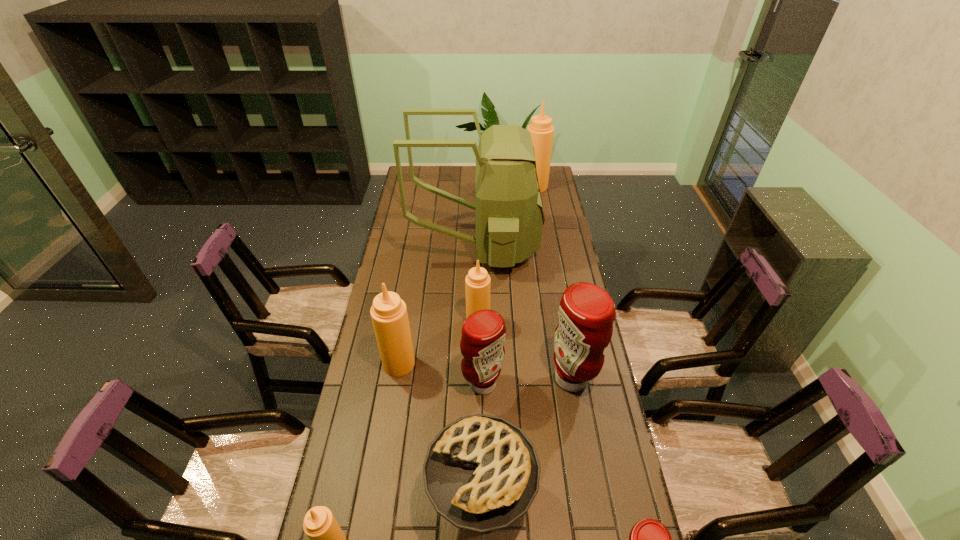
Image resolution: width=960 pixels, height=540 pixels. I want to click on vacant region located 0.130m on the front pocket of the backpack, so click(567, 246).

What are the coordinates of `vacant space located 0.100m on the front of the biggest tan condiment` in the screenshot? It's located at (539, 204).

The image size is (960, 540). Find the location of `blank space located on the back of the second biggest tan condiment`. blank space located on the back of the second biggest tan condiment is located at coordinates (404, 335).

Locate an element on the screen. This screenshot has width=960, height=540. vacant space situated on the front of the biggest red condiment is located at coordinates (581, 430).

The width and height of the screenshot is (960, 540). Find the location of `vacant point located on the left of the leftmost red condiment`. vacant point located on the left of the leftmost red condiment is located at coordinates (380, 383).

The image size is (960, 540). Find the location of `free space located 0.340m on the back of the seventh nearest object`. free space located 0.340m on the back of the seventh nearest object is located at coordinates (478, 255).

Locate an element on the screen. Image resolution: width=960 pixels, height=540 pixels. object that is positioned at the far edge is located at coordinates (542, 131).

The width and height of the screenshot is (960, 540). I want to click on backpack that is at the left edge, so click(509, 216).

The width and height of the screenshot is (960, 540). I want to click on condiment that is at the left edge, so pos(389,315).

At what (x,y) coordinates should I click in order to perform the action: click on backpack that is at the right edge. Please return your answer as a coordinate pair (x, y). Looking at the image, I should click on (509, 216).